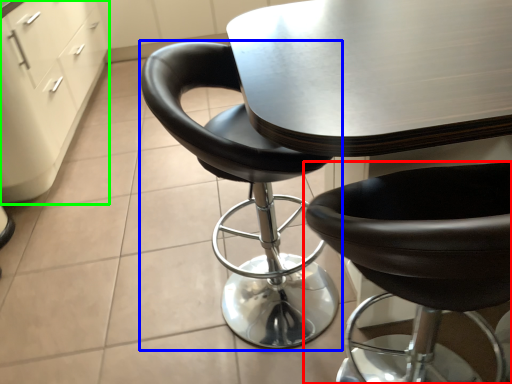
Question: Which object is positioned farthest from chair (highlighted by a red box)? Select from chair (highlighted by a blue box) and file cabinet (highlighted by a green box).

Choices:
 (A) chair
 (B) file cabinet

Answer: (B)